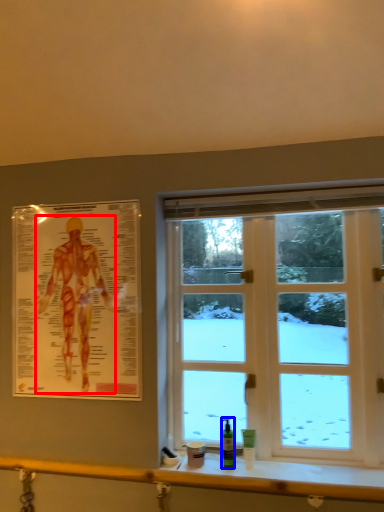
Question: Among these objects, which one is nearest to the camera, person (highlighted by a red box) or toiletry (highlighted by a blue box)?

Choices:
 (A) person
 (B) toiletry

Answer: (B)